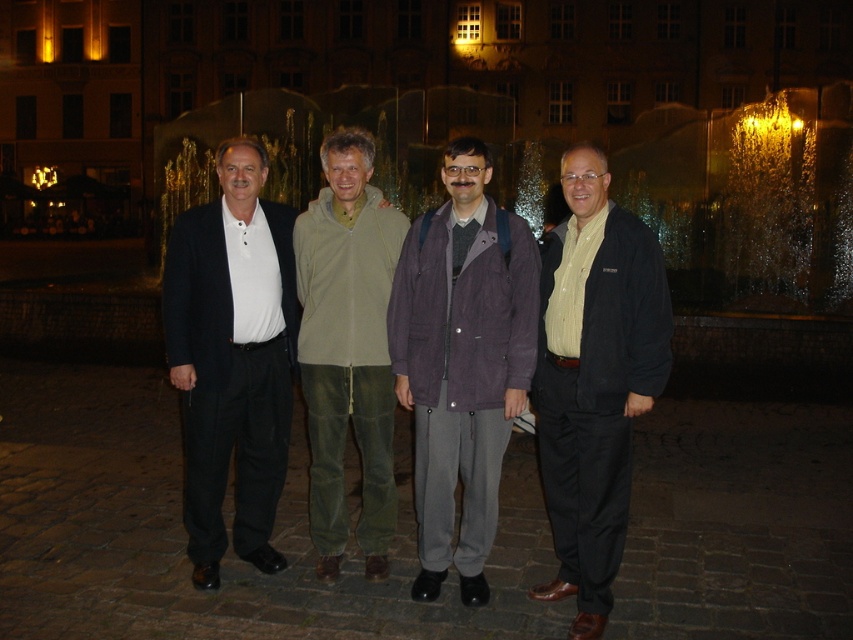
You are a photographer trying to capture a photo of the purple fabric jacket at center and the matte black suit at left. Based on their positions, which object should you focus on first if you want to include both in the same frame without moving the camera?

The purple fabric jacket at center is below matte black suit at left, so you should focus on the matte black suit at left first since it is higher up and ensure the camera frame can capture both vertically.

From the picture: You are a photographer standing in the plaza and want to take a photo of the purple fabric jacket at center and the matte black suit at left. The minimum distance required between subjects for your camera to focus properly is 40 inches. Will the camera be able to focus on both subjects clearly?

The purple fabric jacket at center and the matte black suit at left are 37.48 inches apart from each other. Since this distance is less than the required 40 inches, the camera may struggle to focus on both subjects clearly.

You are organizing a photoshoot and need to arrange the purple fabric jacket at center and the matte black suit at left side by side. Based on their sizes, which one should be placed on the left to avoid overcrowding the frame?

The purple fabric jacket at center is narrower than the matte black suit at left, so placing the narrower purple fabric jacket at center on the left and the wider matte black suit at left on the right would prevent overcrowding the frame.